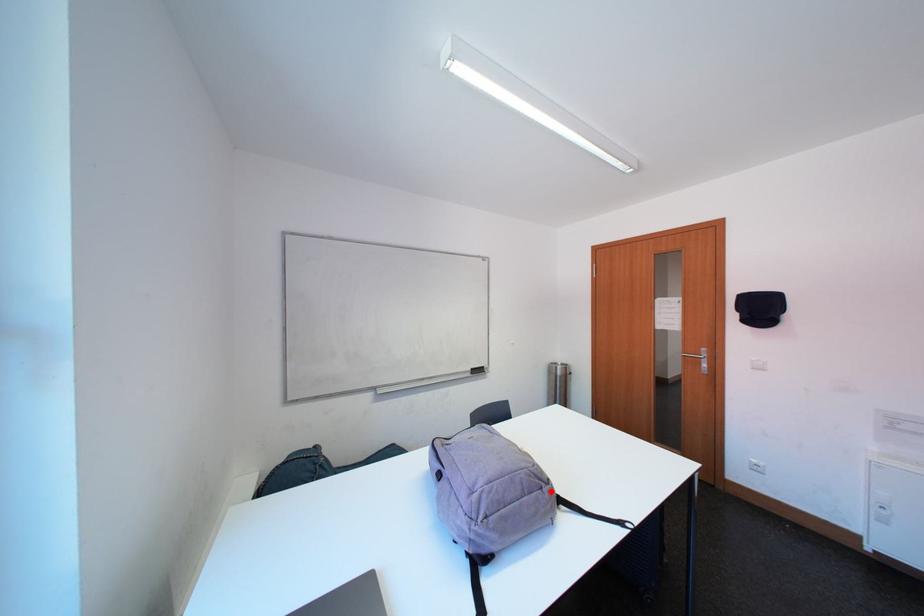
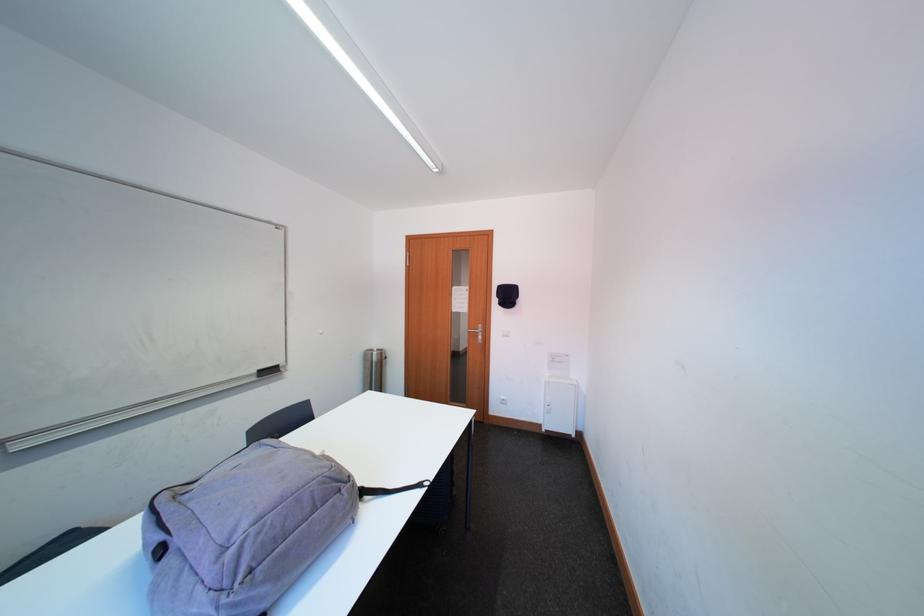
Question: A red point is marked in image1. In image2, is the corresponding 3D point closer to the camera or farther? Reply with the corresponding letter.

Choices:
 (A) The corresponding 3D point is closer.
 (B) The corresponding 3D point is farther.

Answer: (A)